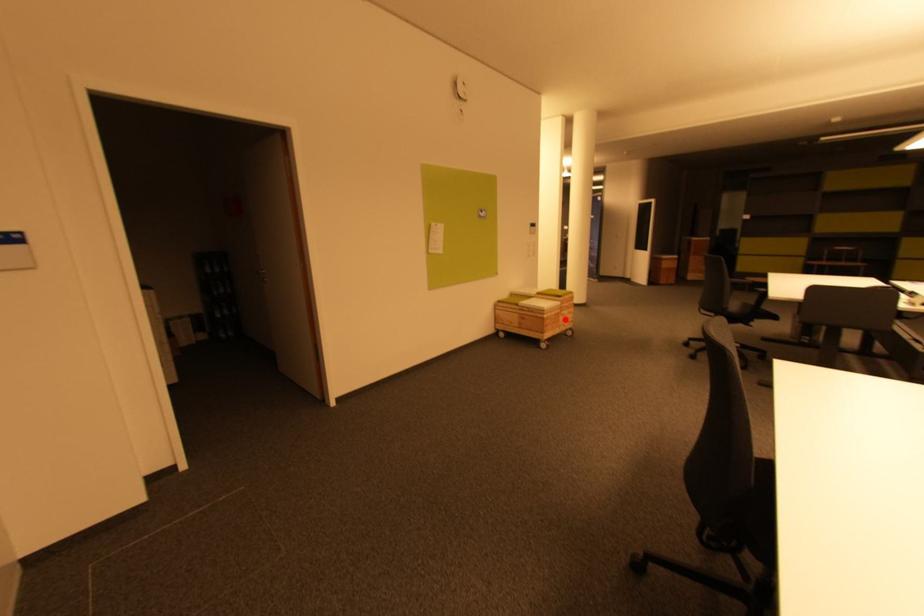
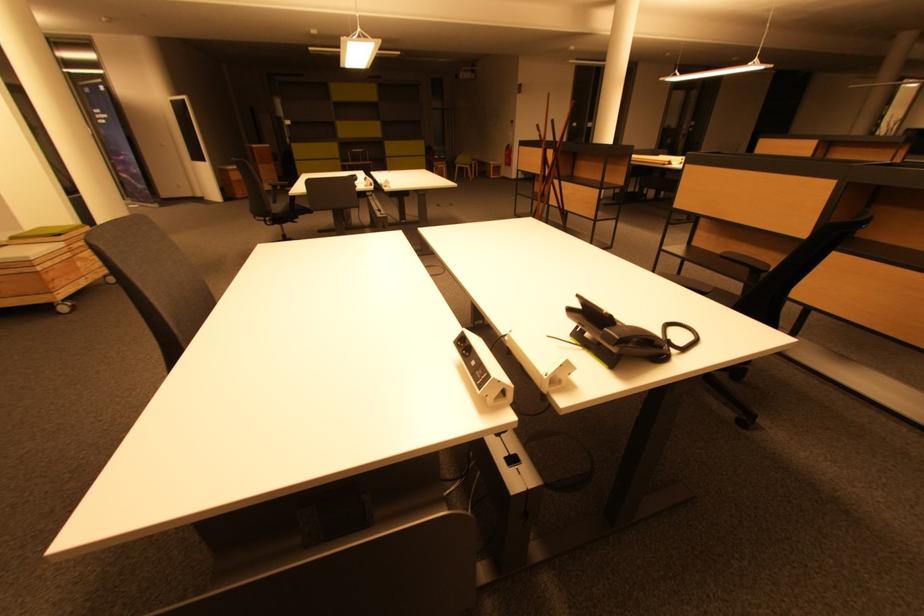
Question: I am providing you with two images of the same scene from different viewpoints. In image1, a red point is highlighted. Considering the same 3D point in image2, which of the following is correct?

Choices:
 (A) It is closer
 (B) It is farther

Answer: (B)